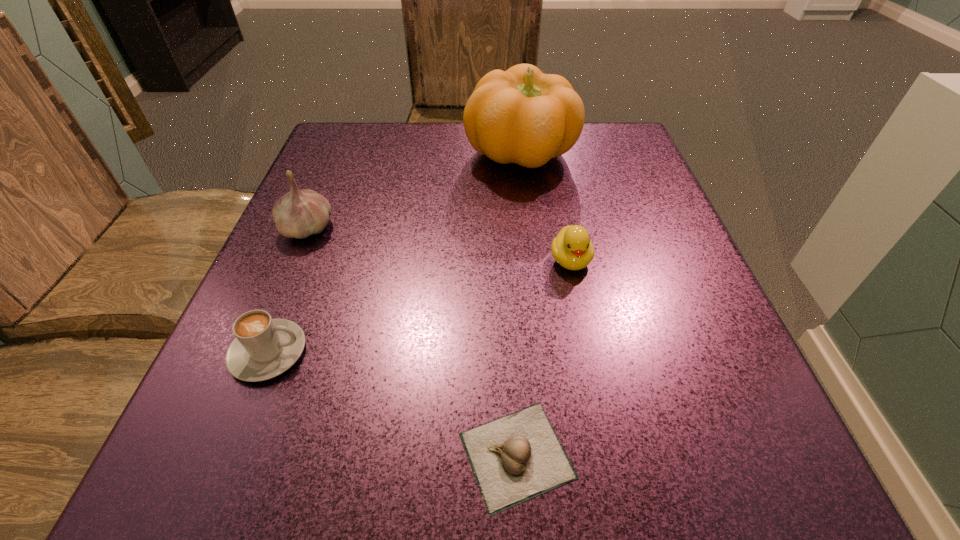
Where is `the farthest object`? the farthest object is located at coordinates (523, 116).

The image size is (960, 540). I want to click on pumpkin, so click(x=523, y=116).

Where is `the taller garlic`? This screenshot has width=960, height=540. the taller garlic is located at coordinates (298, 214).

Find the location of `the left garlic`. the left garlic is located at coordinates (298, 214).

Locate an element on the screen. This screenshot has height=540, width=960. the third tallest object is located at coordinates (572, 248).

At what (x,y) coordinates should I click in order to perform the action: click on the fourth tallest object. Please return your answer as a coordinate pair (x, y). Looking at the image, I should click on (264, 348).

I want to click on the fourth farthest object, so click(x=264, y=348).

Where is `the right garlic`? Image resolution: width=960 pixels, height=540 pixels. the right garlic is located at coordinates (517, 457).

The height and width of the screenshot is (540, 960). In order to click on the nearest object in this screenshot , I will do tap(517, 457).

Identify the location of free point located on the front of the pumpkin. This screenshot has width=960, height=540. (527, 215).